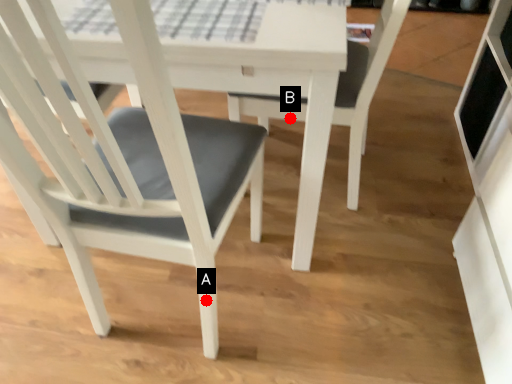
Question: Two points are circled on the image, labeled by A and B beside each circle. Which point is further to the camera?

Choices:
 (A) A is further
 (B) B is further

Answer: (B)